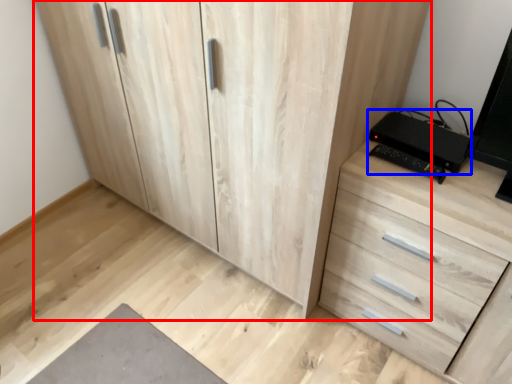
Question: Which of the following is the closest to the observer, cupboard (highlighted by a red box) or computer (highlighted by a blue box)?

Choices:
 (A) cupboard
 (B) computer

Answer: (A)